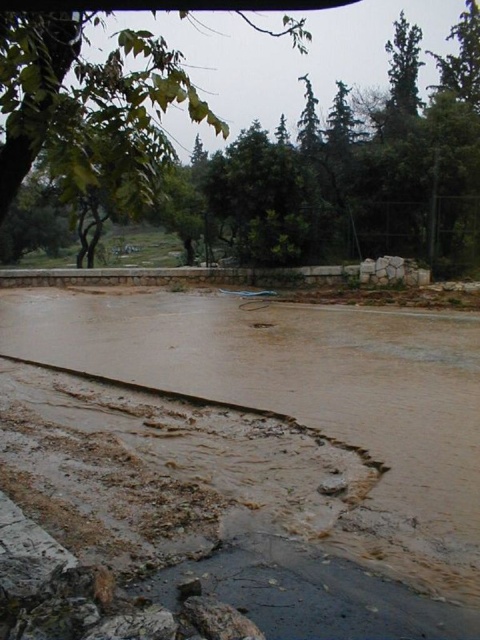
Which is behind, point (159, 374) or point (52, 38)?

The point (159, 374) is more distant.

Which is in front, point (448, 458) or point (79, 104)?

Positioned in front is point (79, 104).

I want to click on brown muddy water at lower left, so click(291, 374).